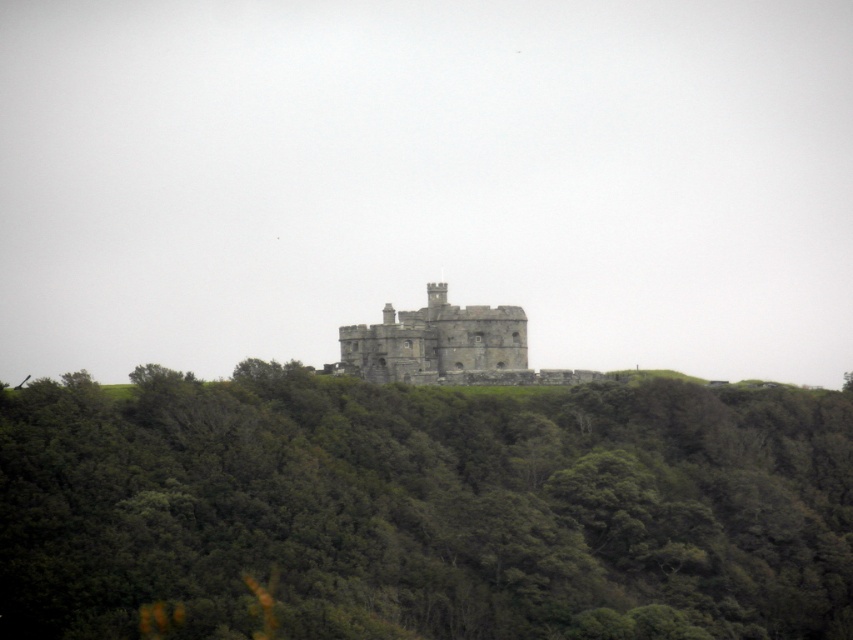
Who is more forward, (241, 483) or (486, 368)?

Positioned in front is point (241, 483).

Does green leafy tree at center lie behind stone castle at center?

No.

What do you see at coordinates (422, 506) in the screenshot? I see `green leafy tree at center` at bounding box center [422, 506].

At what (x,y) coordinates should I click in order to perform the action: click on green leafy tree at center. Please return your answer as a coordinate pair (x, y). The height and width of the screenshot is (640, 853). Looking at the image, I should click on (422, 506).